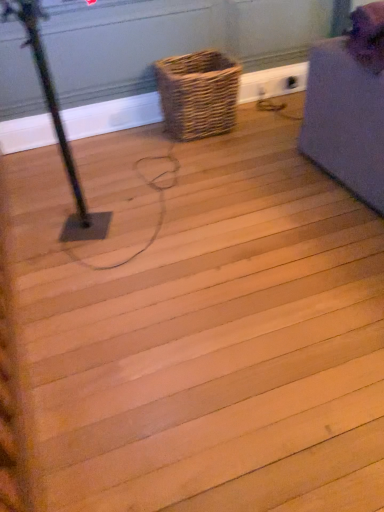
Find the location of a particular element. woven brown basket at center is located at coordinates (198, 94).

Consider the image. In order to face woven brown basket at center, should I rotate leftwards or rightwards?

You should look right and rotate roughly 0.849 degrees.

Describe the element at coordinates (198, 94) in the screenshot. I see `woven brown basket at center` at that location.

Locate an element on the screen. woven brown basket at center is located at coordinates (198, 94).